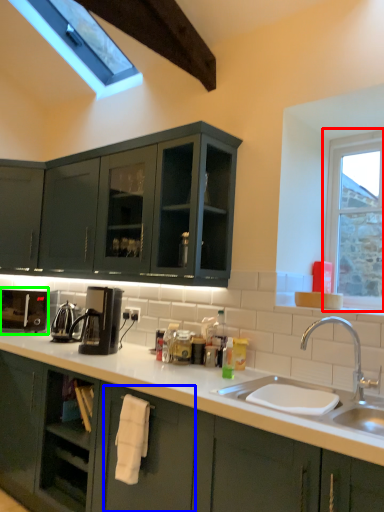
Question: Considering the real-world distances, which object is farthest from window (highlighted by a red box)? drawer (highlighted by a blue box) or coffee machine (highlighted by a green box)?

Choices:
 (A) drawer
 (B) coffee machine

Answer: (B)